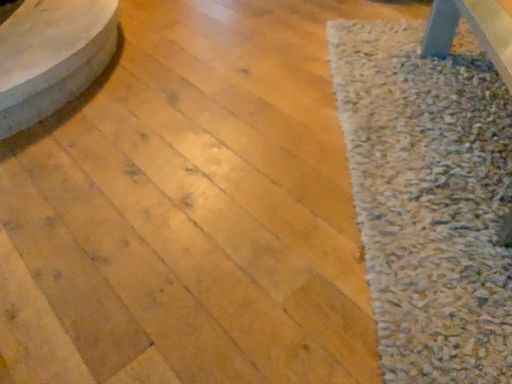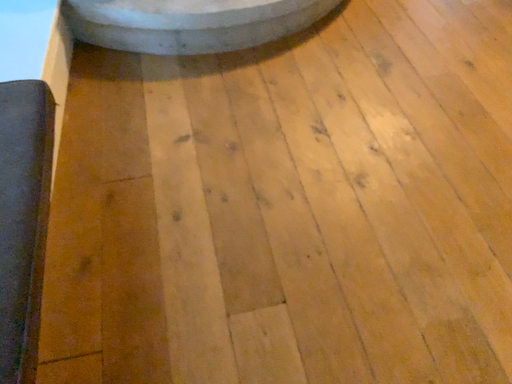
Question: Which way did the camera rotate in the video?

Choices:
 (A) rotated right
 (B) rotated left

Answer: (B)